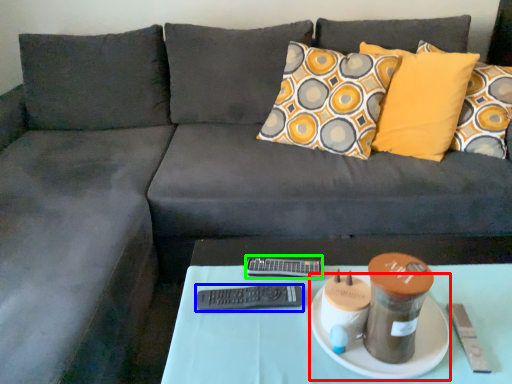
Question: Which object is the farthest from plate (highlighted by a red box)? Choose among these: remote (highlighted by a blue box) or remote (highlighted by a green box).

Choices:
 (A) remote
 (B) remote

Answer: (B)